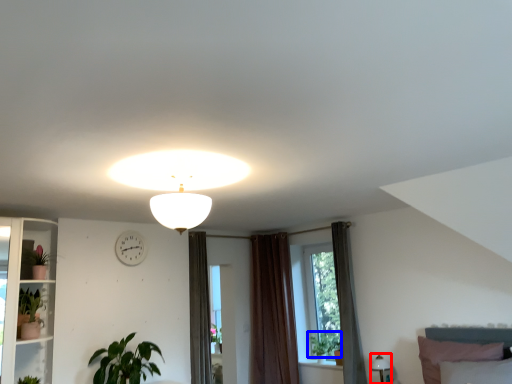
Question: Among these objects, which one is nearest to the camera, lamp (highlighted by a red box) or plant (highlighted by a blue box)?

Choices:
 (A) lamp
 (B) plant

Answer: (A)